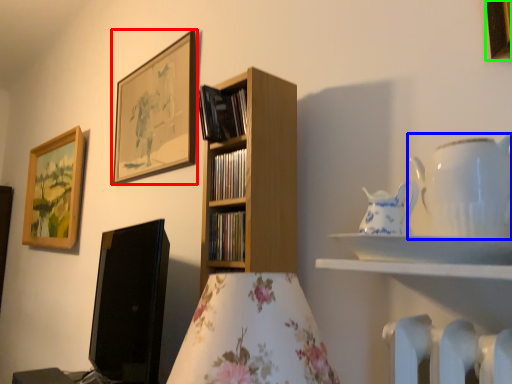
Question: Based on their relative distances, which object is farther from picture frame (highlighted by a red box)? Choose from tableware (highlighted by a blue box) and picture frame (highlighted by a green box).

Choices:
 (A) tableware
 (B) picture frame

Answer: (B)